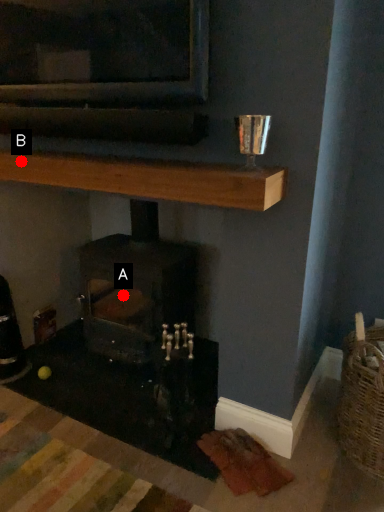
Question: Two points are circled on the image, labeled by A and B beside each circle. Which of the following is the closest to the observer?

Choices:
 (A) A is closer
 (B) B is closer

Answer: (B)